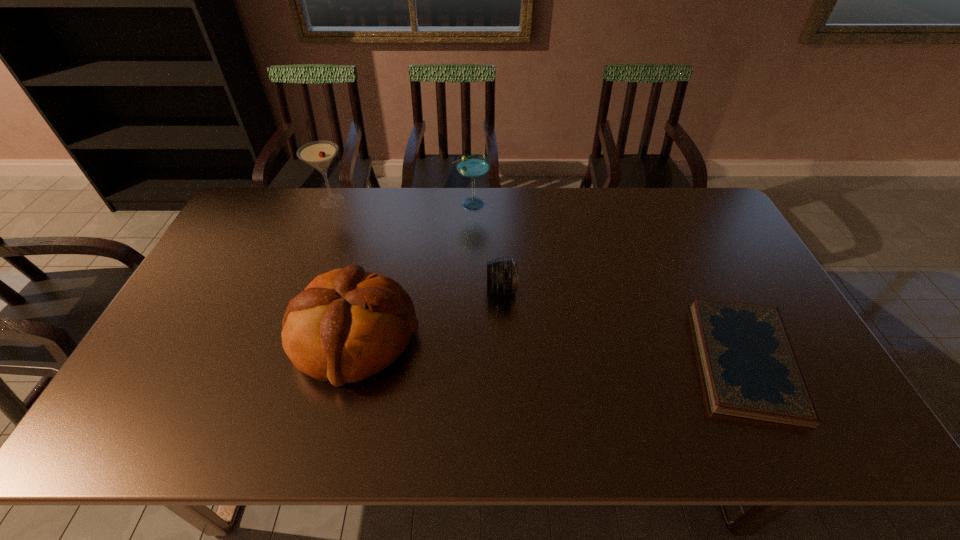
Image resolution: width=960 pixels, height=540 pixels. Find the location of `free region at the far left corner of the desktop`. free region at the far left corner of the desktop is located at coordinates (289, 190).

This screenshot has width=960, height=540. Identify the location of free space at the far right corner of the desktop. (695, 229).

This screenshot has height=540, width=960. Find the location of `vacant area between the left martini and the telephoto lens`. vacant area between the left martini and the telephoto lens is located at coordinates (417, 245).

Image resolution: width=960 pixels, height=540 pixels. I want to click on vacant space that is in between the rightmost object and the bread, so click(549, 348).

Identify the location of vacant point located between the bread and the paperback book. The image size is (960, 540). (549, 348).

This screenshot has width=960, height=540. In order to click on vacant space in between the right martini and the telephoto lens in this screenshot , I will do `click(487, 246)`.

Identify the location of unoccupied position between the taller martini and the right martini. This screenshot has height=540, width=960. (402, 202).

I want to click on unoccupied position between the shorter martini and the left martini, so click(402, 202).

In order to click on free spot between the second shortest object and the shortest object in this screenshot , I will do `click(623, 324)`.

The height and width of the screenshot is (540, 960). I want to click on free space between the bread and the rightmost object, so click(549, 348).